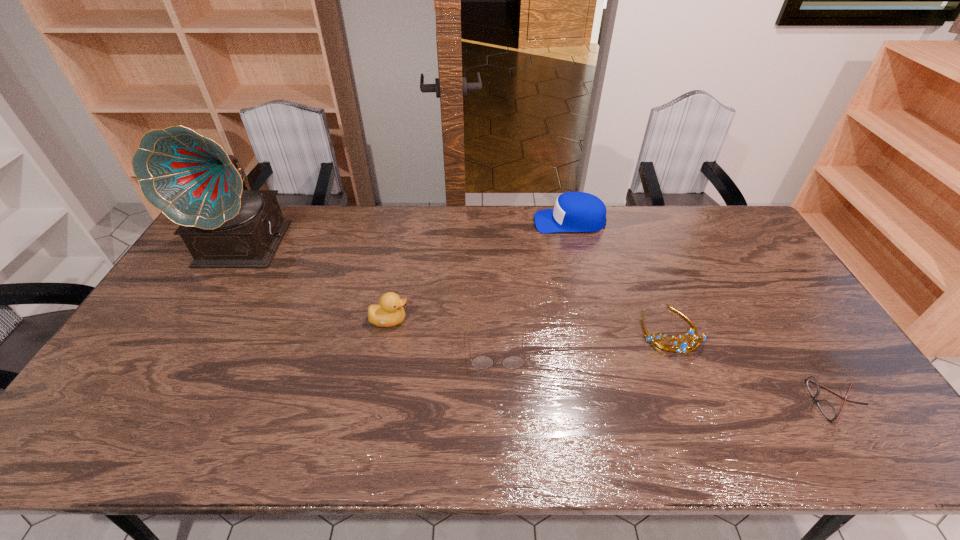
Find the location of a particular element. The width and height of the screenshot is (960, 540). vacant region between the fourth object from right to left and the tiara is located at coordinates (584, 340).

Find the location of `free space between the left spectacles and the duckling`. free space between the left spectacles and the duckling is located at coordinates tap(444, 335).

Where is `empty space between the right spectacles and the record player`? empty space between the right spectacles and the record player is located at coordinates (541, 323).

This screenshot has width=960, height=540. Find the location of `vacant area that lies between the left spectacles and the fifth object from right to left`. vacant area that lies between the left spectacles and the fifth object from right to left is located at coordinates (444, 335).

Where is `vacant area that lies between the second shortest object and the tiara`? The width and height of the screenshot is (960, 540). vacant area that lies between the second shortest object and the tiara is located at coordinates (584, 340).

Locate an element on the screen. free space between the nearer spectacles and the baseball cap is located at coordinates (702, 312).

Identify the location of free space between the second object from left to right and the right spectacles. The height and width of the screenshot is (540, 960). (612, 361).

This screenshot has height=540, width=960. In order to click on free point between the second shortest object and the leftmost object in this screenshot , I will do `click(372, 298)`.

Locate an element on the screen. The height and width of the screenshot is (540, 960). vacant space that's between the nearer spectacles and the tiara is located at coordinates (753, 366).

Locate an element on the screen. This screenshot has width=960, height=540. the closest object to the second shortest object is located at coordinates (389, 312).